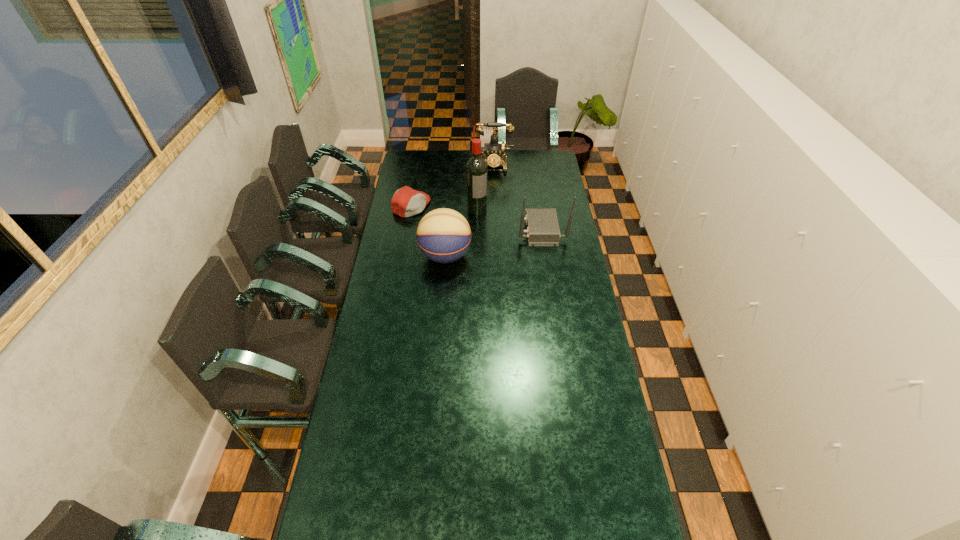
The height and width of the screenshot is (540, 960). What are the coordinates of `object that is at the right edge` in the screenshot? It's located at (542, 225).

Image resolution: width=960 pixels, height=540 pixels. In order to click on vacant point at the far edge in this screenshot , I will do `click(465, 168)`.

The width and height of the screenshot is (960, 540). In order to click on free space at the near edge of the desktop in this screenshot , I will do `click(432, 518)`.

Identify the location of vacant area at the left edge. (377, 292).

Find the location of `vacant position at the right edge of the desktop`. vacant position at the right edge of the desktop is located at coordinates (620, 440).

At what (x,y) coordinates should I click in order to perform the action: click on free area in between the telephone and the shortest object. Please return your answer as a coordinate pair (x, y). The height and width of the screenshot is (540, 960). Looking at the image, I should click on (452, 185).

Find the location of a particular element. free spot between the router and the basketball is located at coordinates (493, 243).

Identify the location of blank region between the router and the telephone. (516, 198).

The width and height of the screenshot is (960, 540). What are the coordinates of `free space between the tallest object and the shortest object` in the screenshot? It's located at (444, 207).

This screenshot has height=540, width=960. Find the location of `free space between the wine bottle and the cap`. free space between the wine bottle and the cap is located at coordinates (444, 207).